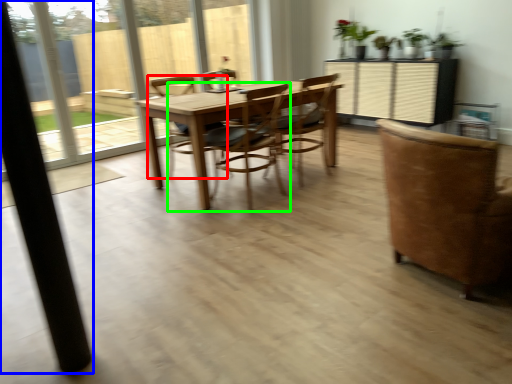
Question: Which is nearer to the chair (highlighted by a red box)? pillar (highlighted by a blue box) or chair (highlighted by a green box).

Choices:
 (A) pillar
 (B) chair

Answer: (B)